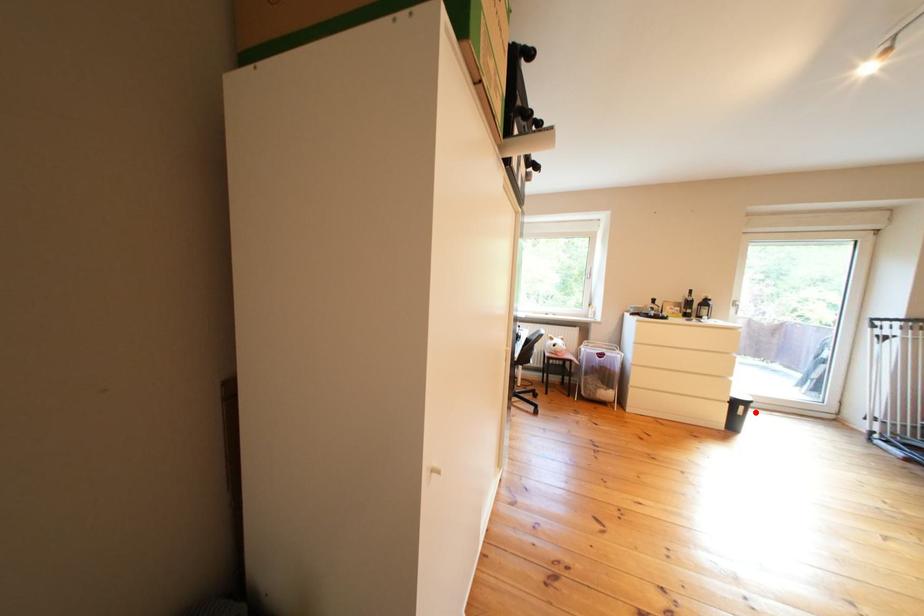
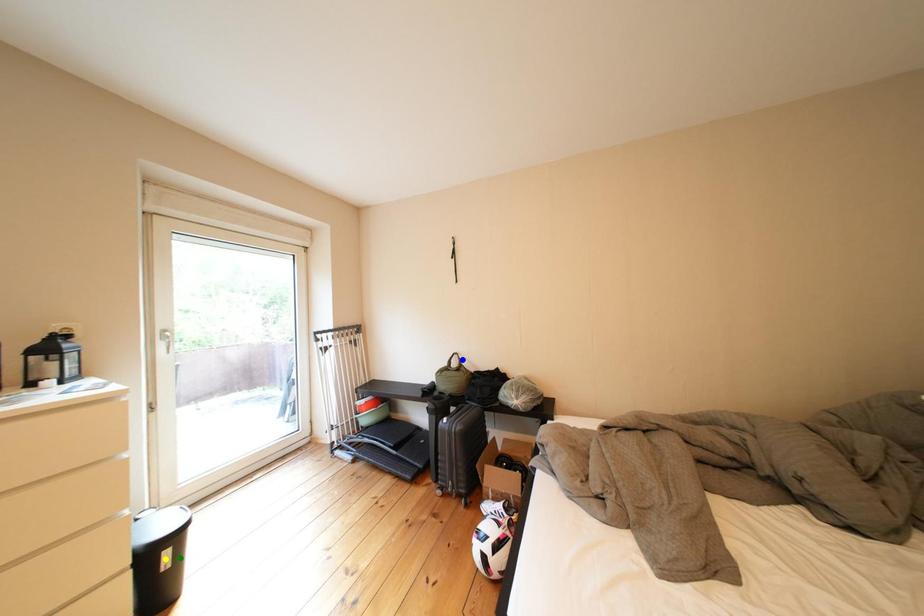
Question: I am providing you with two images of the same scene from different viewpoints. A red point is marked on the first image. You are given multiple points on the second image. Which mark in image 2 goes with the point in image 1?

Choices:
 (A) blue point
 (B) green point
 (C) yellow point

Answer: (B)